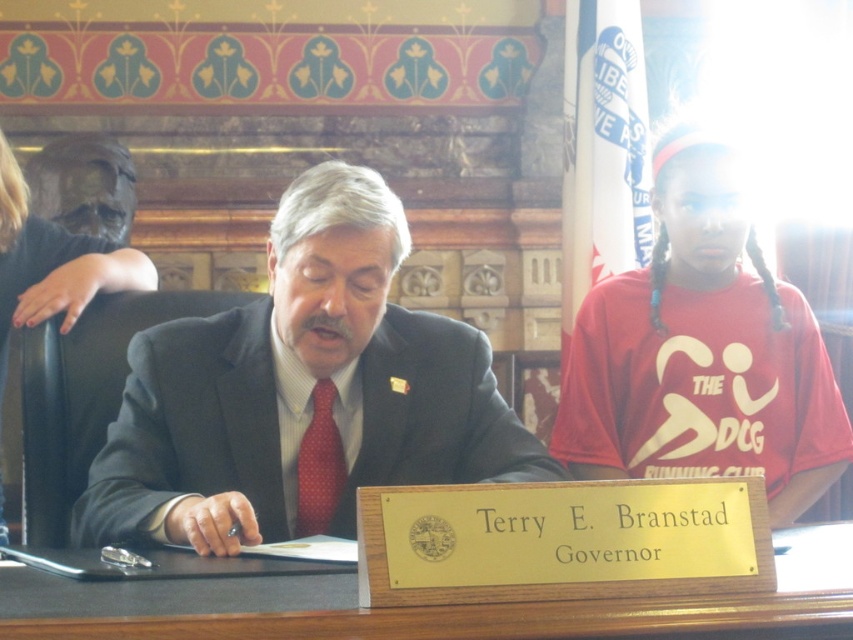
Question: Observing the image, what is the correct spatial positioning of dark gray suit at center in reference to wooden table at center?

Choices:
 (A) above
 (B) below

Answer: (A)

Question: Which object appears closest to the camera in this image?

Choices:
 (A) red dotted tie at center
 (B) dark gray suit at center
 (C) wooden table at center

Answer: (C)

Question: Among these points, which one is farthest from the camera?

Choices:
 (A) (265, 630)
 (B) (300, 484)
 (C) (277, 464)

Answer: (B)

Question: Which object appears closest to the camera in this image?

Choices:
 (A) wooden table at center
 (B) red dotted tie at center

Answer: (A)

Question: Does dark gray suit at center have a larger size compared to wooden table at center?

Choices:
 (A) no
 (B) yes

Answer: (B)

Question: Is wooden table at center positioned at the back of red dotted tie at center?

Choices:
 (A) yes
 (B) no

Answer: (B)